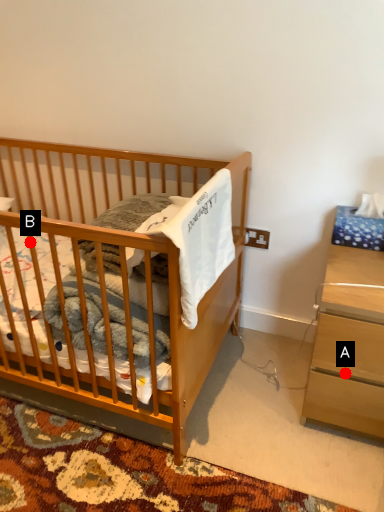
Question: Two points are circled on the image, labeled by A and B beside each circle. Among these points, which one is nearest to the camera?

Choices:
 (A) A is closer
 (B) B is closer

Answer: (B)